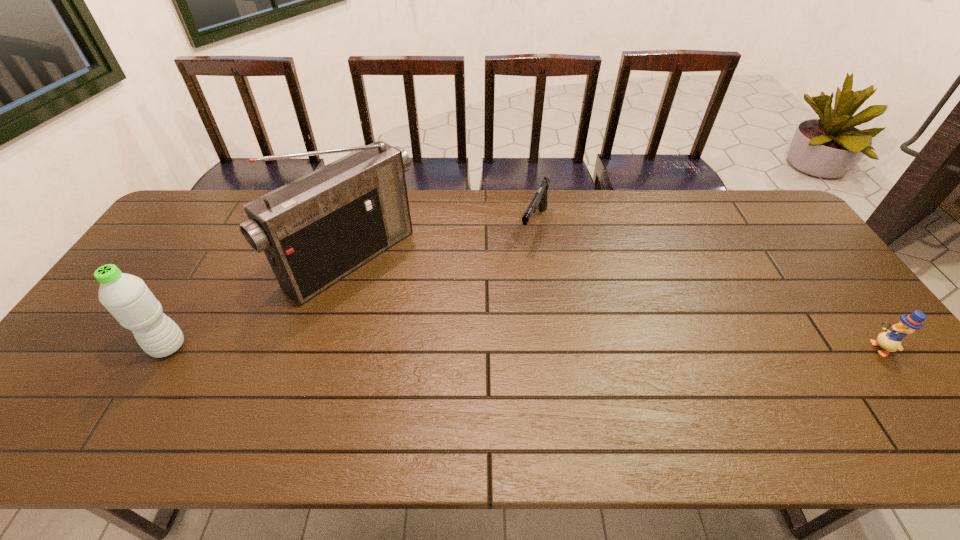
Find the location of a particular element. the second tallest object is located at coordinates (129, 300).

This screenshot has height=540, width=960. I want to click on the leftmost object, so click(129, 300).

Where is `the rightmost object`? This screenshot has height=540, width=960. the rightmost object is located at coordinates (891, 341).

Image resolution: width=960 pixels, height=540 pixels. Identify the location of gun. (539, 200).

This screenshot has width=960, height=540. Find the location of `the tallest object`. the tallest object is located at coordinates (316, 230).

Identify the location of the third object from right to left. (316, 230).

Locate an element on the screen. free point located 0.210m on the back of the leftmost object is located at coordinates (211, 275).

The height and width of the screenshot is (540, 960). I want to click on vacant space situated on the face of the rightmost object, where the monocle is placed, so click(712, 348).

Image resolution: width=960 pixels, height=540 pixels. What are the coordinates of `free space located on the face of the rightmost object, where the monocle is placed` in the screenshot? It's located at (788, 348).

Where is `free region located 0.210m on the face of the rightmost object, where the monocle is placed`? The height and width of the screenshot is (540, 960). free region located 0.210m on the face of the rightmost object, where the monocle is placed is located at coordinates coord(788,348).